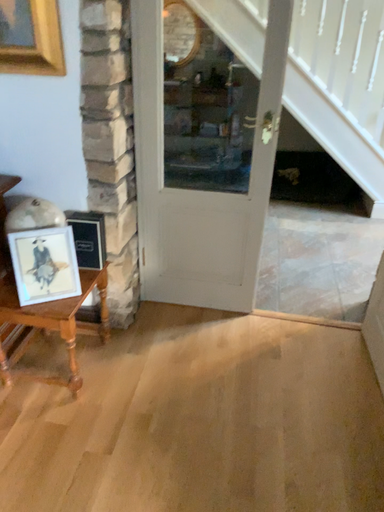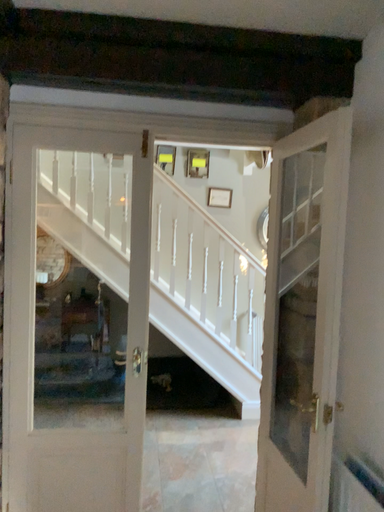
Question: How did the camera likely rotate when shooting the video?

Choices:
 (A) rotated upward
 (B) rotated downward

Answer: (A)